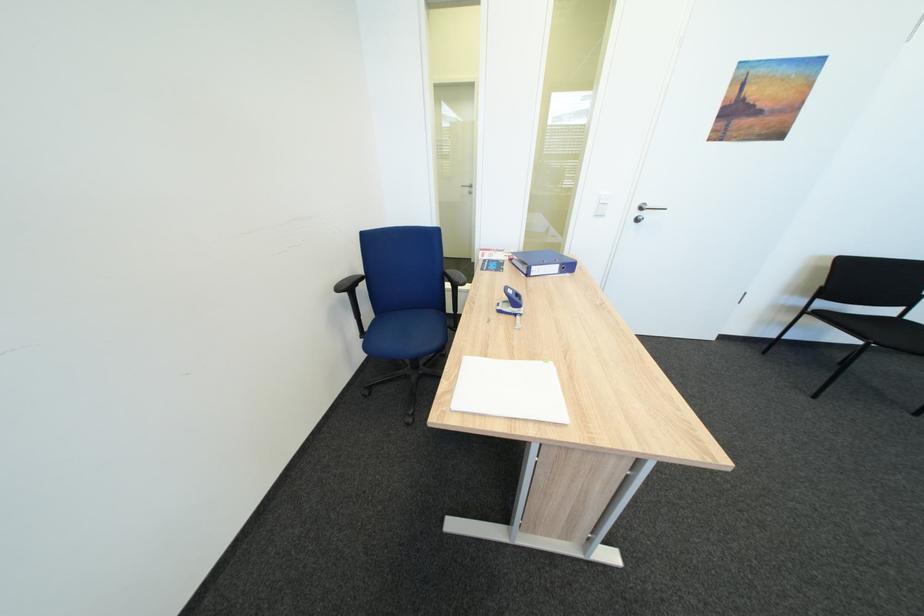
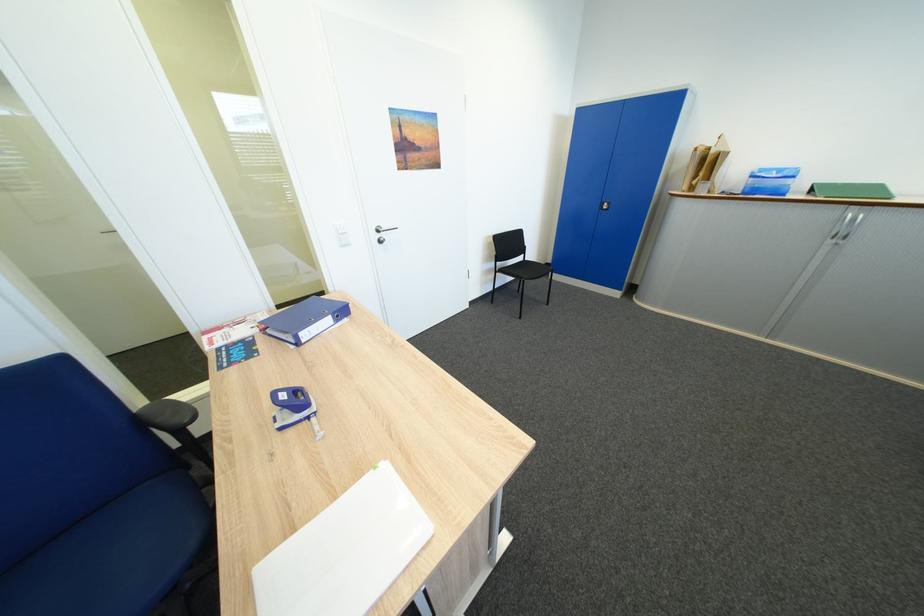
Question: How did the camera likely rotate?

Choices:
 (A) Left
 (B) Right
 (C) Up
 (D) Down

Answer: (B)